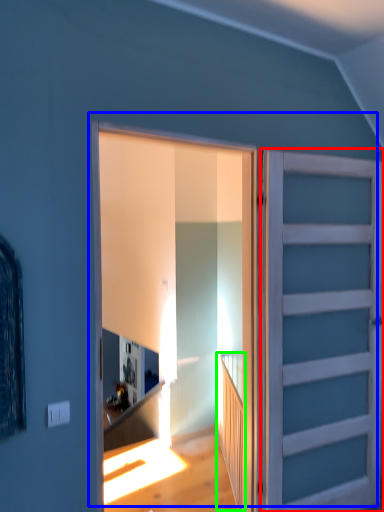
Question: Based on their relative distances, which object is nearer to door (highlighted by a red box)? Choose from door (highlighted by a blue box) and stairwell (highlighted by a green box).

Choices:
 (A) door
 (B) stairwell

Answer: (A)